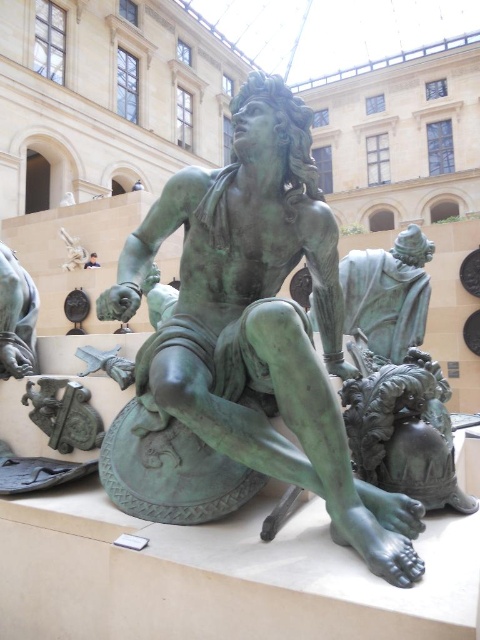
You are a museum visitor standing in front of the green patina bronze statue at center and the green patina statue at center. Which one is closer to you?

The green patina bronze statue at center is closer to you because it is in front of the green patina statue at center.

You are a museum visitor standing in front of the green patina bronze statue at center and the green patina statue at center. Which one is positioned lower in the image?

The green patina bronze statue at center is positioned lower than the green patina statue at center.